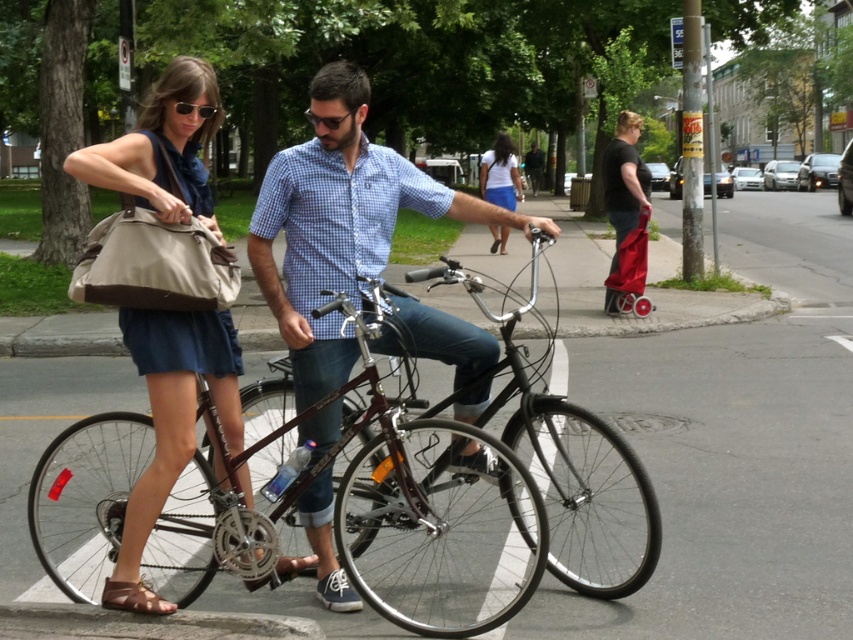
You are a photographer standing in front of the two shirts displayed at the center of the scene. You want to take a photo that focuses on the matte blue shirt at center without the white cotton shirt at center being in the foreground. Is the current arrangement possible for this shot?

The matte blue shirt at center is closer to the viewer than the white cotton shirt at center, so yes, the photographer can take a photo focusing on the matte blue shirt at center without the white cotton shirt at center being in the foreground since it is farther away.

You are a delivery person who needs to place a 15 cm wide package. You see the matte beige tote bag at left and the white cotton shirt at center. Which object can the package fit into based on their widths?

The matte beige tote bag at left has a width less than the white cotton shirt at center. Since the package is 15 cm wide, it can fit into the white cotton shirt at center if its width is at least 15 cm, but cannot fit into the matte beige tote bag at left if its width is narrower than 15 cm. However, the exact widths aren not provided, so we can only state the relative sizes.